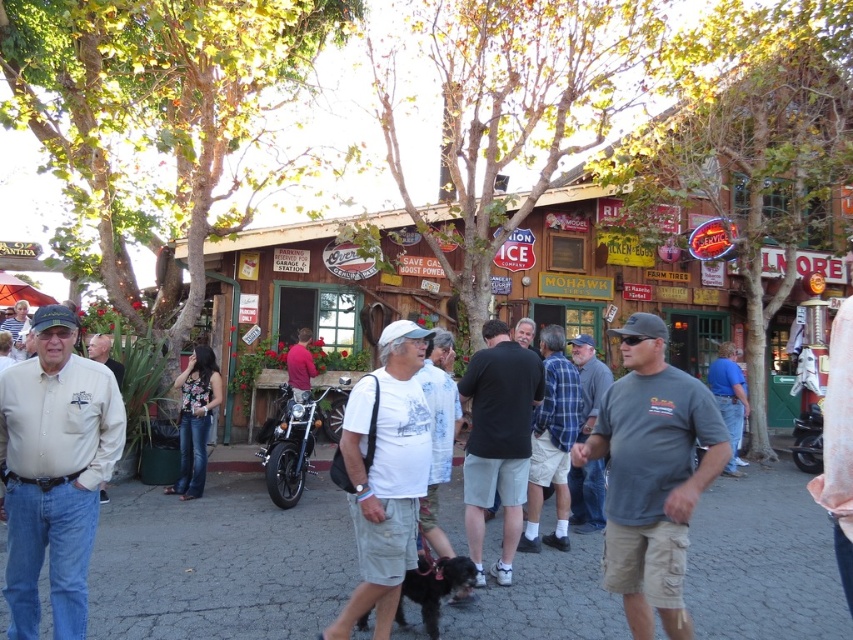
Is gray cotton t-shirt at center taller than gray cotton shirt at center?

Correct, gray cotton t-shirt at center is much taller as gray cotton shirt at center.

Which of these two, gray cotton t-shirt at center or gray cotton shirt at center, stands shorter?

gray cotton shirt at center is shorter.

Find the location of `gray cotton t-shirt at center`. gray cotton t-shirt at center is located at coordinates (653, 474).

Is white cotton t-shirt at center smaller than gray cotton shirt at center?

Incorrect, white cotton t-shirt at center is not smaller in size than gray cotton shirt at center.

How distant is white cotton t-shirt at center from gray cotton shirt at center?

3.33 meters

This screenshot has width=853, height=640. In order to click on white cotton t-shirt at center in this screenshot , I will do `click(386, 476)`.

Between light beige shirt at center and gray cotton shirt at center, which one has less height?

Standing shorter between the two is gray cotton shirt at center.

Can you confirm if light beige shirt at center is wider than gray cotton shirt at center?

Yes, light beige shirt at center is wider than gray cotton shirt at center.

Between point (76, 436) and point (581, 348), which one is positioned behind?

The point (581, 348) is behind.

This screenshot has width=853, height=640. What are the coordinates of `light beige shirt at center` in the screenshot? It's located at pos(54,472).